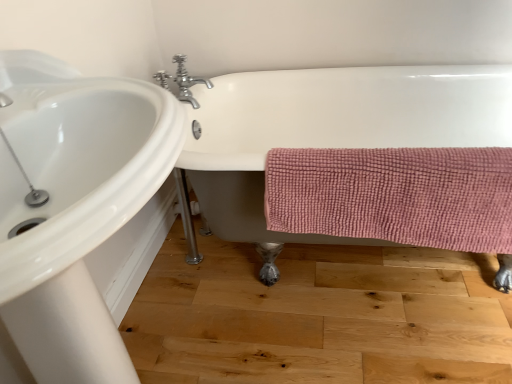
The width and height of the screenshot is (512, 384). I want to click on empty space that is ontop of pink textured towel at lower right (from a real-world perspective), so click(x=391, y=155).